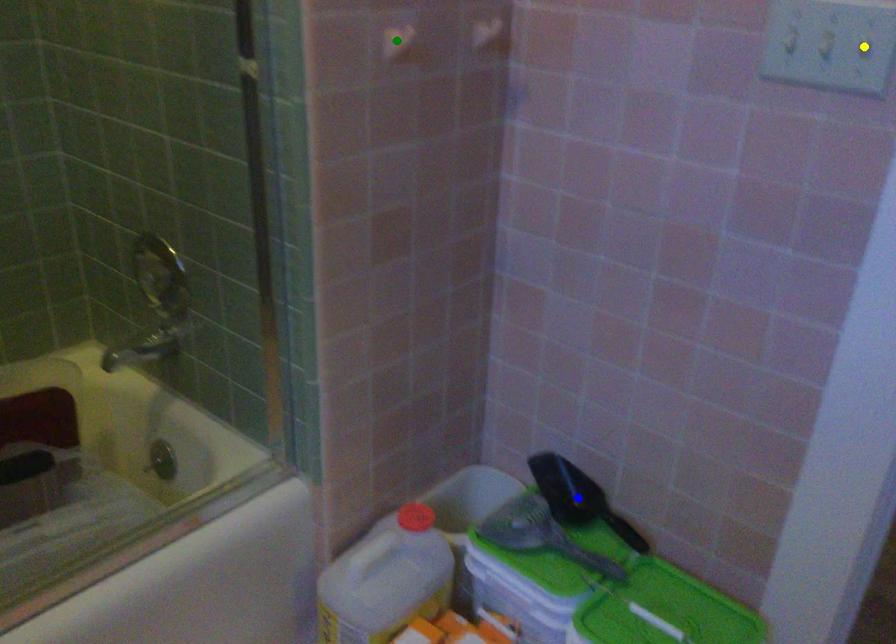
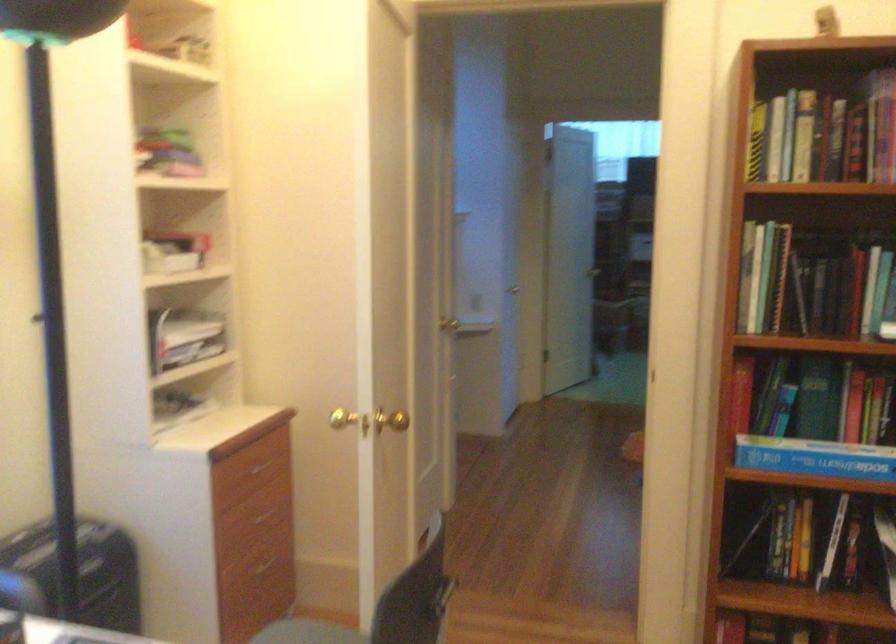
I am providing you with two images of the same scene from different viewpoints. Three points are marked in image1. Which point corresponds to a part or object that is occluded in image2?In image1, three points are marked. Which of them correspond to a part or object that is occluded in image2?Among the three points shown in image1, which one corresponds to a part or object that is no longer visible due to occlusion in image2?

blue point, yellow point, green point cannot be seen in image2.